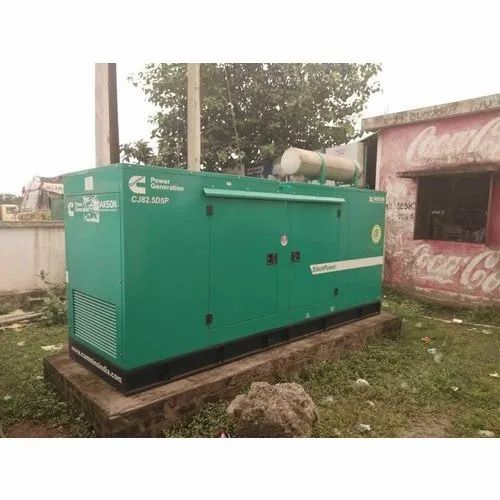
The height and width of the screenshot is (500, 500). I want to click on window, so click(468, 220).